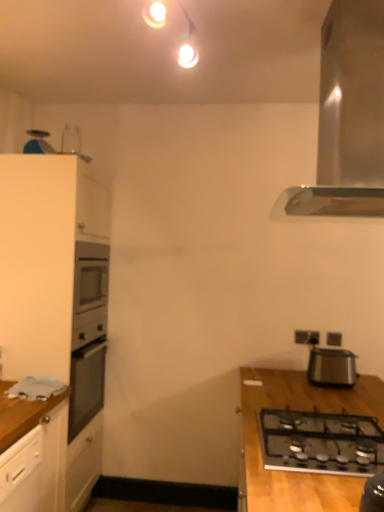
The height and width of the screenshot is (512, 384). Identify the location of wooden table at lower right. (302, 410).

How much space does black plastic electric outlet at upper right, which is counted as the 2th electric outlet, starting from the left, occupy horizontally?

0.76 inches.

Image resolution: width=384 pixels, height=512 pixels. What do you see at coordinates (334, 339) in the screenshot?
I see `black plastic electric outlet at upper right, arranged as the 1th electric outlet when viewed from the right` at bounding box center [334, 339].

Image resolution: width=384 pixels, height=512 pixels. Identify the location of white matte cabinet at left. point(52,328).

This screenshot has height=512, width=384. In order to click on wooden table at lower right in this screenshot , I will do `click(302, 410)`.

Are black plastic electric outlet at upper right, arranged as the 1th electric outlet when viewed from the right, and white matte cabinet at left far apart?

Yes, black plastic electric outlet at upper right, arranged as the 1th electric outlet when viewed from the right, is far from white matte cabinet at left.

Who is shorter, black plastic electric outlet at upper right, which is counted as the 2th electric outlet, starting from the left, or white matte cabinet at left?

Standing shorter between the two is black plastic electric outlet at upper right, which is counted as the 2th electric outlet, starting from the left.

In terms of size, does black plastic electric outlet at upper right, which is counted as the 2th electric outlet, starting from the left, appear bigger or smaller than white matte cabinet at left?

In the image, black plastic electric outlet at upper right, which is counted as the 2th electric outlet, starting from the left, appears to be smaller than white matte cabinet at left.

Does black plastic electric outlet at upper right, which is counted as the 2th electric outlet, starting from the left, have a lesser width compared to white matte cabinet at left?

Yes, black plastic electric outlet at upper right, which is counted as the 2th electric outlet, starting from the left, is thinner than white matte cabinet at left.

From their relative heights in the image, would you say black plastic electric outlet at upper right, arranged as the 1th electric outlet when viewed from the right, is taller or shorter than wooden table at lower right?

black plastic electric outlet at upper right, arranged as the 1th electric outlet when viewed from the right, is shorter than wooden table at lower right.

Would you consider black plastic electric outlet at upper right, which is counted as the 2th electric outlet, starting from the left, to be distant from wooden table at lower right?

No, black plastic electric outlet at upper right, which is counted as the 2th electric outlet, starting from the left, is not far from wooden table at lower right.

From a real-world perspective, who is located higher, black plastic electric outlet at upper right, which is counted as the 2th electric outlet, starting from the left, or wooden table at lower right?

From a 3D spatial view, black plastic electric outlet at upper right, which is counted as the 2th electric outlet, starting from the left, is above.

Considering the relative sizes of black glass gas stove at lower right and white matte cabinet at left in the image provided, is black glass gas stove at lower right taller than white matte cabinet at left?

Incorrect, the height of black glass gas stove at lower right is not larger of that of white matte cabinet at left.

Is black glass gas stove at lower right facing towards white matte cabinet at left?

No, black glass gas stove at lower right is not oriented towards white matte cabinet at left.

Is black glass gas stove at lower right in front of white matte cabinet at left?

Yes, black glass gas stove at lower right is closer to the camera.

From a real-world perspective, is black glass gas stove at lower right positioned above or below white matte cabinet at left?

From a real-world perspective, black glass gas stove at lower right is physically below white matte cabinet at left.

From the image's perspective, which object appears higher, black glass gas stove at lower right or black plastic toaster at right?

black plastic toaster at right is shown above in the image.

Which is closer, (302, 470) or (340, 371)?

Point (302, 470) appears to be closer to the viewer than point (340, 371).

Considering the relative sizes of black glass gas stove at lower right and black plastic toaster at right in the image provided, is black glass gas stove at lower right thinner than black plastic toaster at right?

No.

Who is taller, black glass gas stove at lower right or black plastic toaster at right?

black plastic toaster at right is taller.

Which is farther from the camera, [330,341] or [302,333]?

The point [302,333] is farther from the camera.

Can white plastic electric outlet at upper right, placed as the 1th electric outlet when sorted from left to right, be found inside black plastic electric outlet at upper right, arranged as the 1th electric outlet when viewed from the right?

No.

Can you confirm if black plastic electric outlet at upper right, which is counted as the 2th electric outlet, starting from the left, is taller than white plastic electric outlet at upper right, marked as the 2th electric outlet in a right-to-left arrangement?

No.

From the image's perspective, which is below, black plastic electric outlet at upper right, which is counted as the 2th electric outlet, starting from the left, or white plastic electric outlet at upper right, placed as the 1th electric outlet when sorted from left to right?

black plastic electric outlet at upper right, which is counted as the 2th electric outlet, starting from the left, is shown below in the image.

Considering the points (322, 378) and (331, 337), which point is in front, point (322, 378) or point (331, 337)?

Positioned in front is point (322, 378).

The width and height of the screenshot is (384, 512). What are the coordinates of `appliance below the black plastic electric outlet at upper right, arranged as the 1th electric outlet when viewed from the right (from a real-world perspective)` in the screenshot? It's located at (331, 367).

Looking at this image, considering the sizes of objects black plastic toaster at right and black plastic electric outlet at upper right, which is counted as the 2th electric outlet, starting from the left, in the image provided, who is bigger, black plastic toaster at right or black plastic electric outlet at upper right, which is counted as the 2th electric outlet, starting from the left,?

Bigger between the two is black plastic toaster at right.

Is white matte cabinet at left not near black plastic toaster at right?

Yes, white matte cabinet at left and black plastic toaster at right are located far from each other.

The image size is (384, 512). Find the location of `cabinetry on the left side of black plastic toaster at right`. cabinetry on the left side of black plastic toaster at right is located at coordinates (52, 328).

Is white matte cabinet at left oriented towards black plastic toaster at right?

Yes, white matte cabinet at left is aimed at black plastic toaster at right.

Does white matte cabinet at left have a greater width compared to black plastic toaster at right?

Indeed, white matte cabinet at left has a greater width compared to black plastic toaster at right.

This screenshot has height=512, width=384. In order to click on cabinetry on the left of the black plastic electric outlet at upper right, arranged as the 1th electric outlet when viewed from the right in this screenshot , I will do `click(52, 328)`.

Find the location of a particular element. Image resolution: width=384 pixels, height=512 pixels. table in front of the black plastic electric outlet at upper right, arranged as the 1th electric outlet when viewed from the right is located at coordinates (302, 410).

Based on their spatial positions, is wooden table at lower right or black glass gas stove at lower right closer to satin silver range hood at upper right?

black glass gas stove at lower right is closer to satin silver range hood at upper right.

Estimate the real-world distances between objects in this image. Which object is further from white matte cabinet at left, satin silver range hood at upper right or black glass gas stove at lower right?

satin silver range hood at upper right.

Estimate the real-world distances between objects in this image. Which object is further from white plastic electric outlet at upper right, marked as the 2th electric outlet in a right-to-left arrangement, black glass gas stove at lower right or wooden table at lower right?

Based on the image, black glass gas stove at lower right appears to be further to white plastic electric outlet at upper right, marked as the 2th electric outlet in a right-to-left arrangement.

Estimate the real-world distances between objects in this image. Which object is closer to satin silver range hood at upper right, black plastic toaster at right or white matte cabinet at left?

black plastic toaster at right is positioned closer to the anchor satin silver range hood at upper right.

Based on their spatial positions, is white plastic electric outlet at upper right, marked as the 2th electric outlet in a right-to-left arrangement, or satin silver range hood at upper right further from black plastic toaster at right?

satin silver range hood at upper right lies further to black plastic toaster at right than the other object.

Which object lies further to the anchor point white plastic electric outlet at upper right, marked as the 2th electric outlet in a right-to-left arrangement, black glass gas stove at lower right or black plastic electric outlet at upper right, arranged as the 1th electric outlet when viewed from the right?

The object further to white plastic electric outlet at upper right, marked as the 2th electric outlet in a right-to-left arrangement, is black glass gas stove at lower right.

Estimate the real-world distances between objects in this image. Which object is closer to white matte cabinet at left, black plastic toaster at right or wooden table at lower right?

Among the two, wooden table at lower right is located nearer to white matte cabinet at left.

Which object lies nearer to the anchor point black glass gas stove at lower right, wooden table at lower right or satin silver range hood at upper right?

wooden table at lower right.

The height and width of the screenshot is (512, 384). Find the location of `home appliance positioned between wooden table at lower right and white plastic electric outlet at upper right, marked as the 2th electric outlet in a right-to-left arrangement, from near to far`. home appliance positioned between wooden table at lower right and white plastic electric outlet at upper right, marked as the 2th electric outlet in a right-to-left arrangement, from near to far is located at coordinates (347, 118).

Image resolution: width=384 pixels, height=512 pixels. Identify the location of home appliance between wooden table at lower right and black plastic electric outlet at upper right, arranged as the 1th electric outlet when viewed from the right, along the z-axis. (347, 118).

At what (x,y) coordinates should I click in order to perform the action: click on appliance that lies between satin silver range hood at upper right and wooden table at lower right from top to bottom. Please return your answer as a coordinate pair (x, y). Image resolution: width=384 pixels, height=512 pixels. Looking at the image, I should click on (331, 367).

Where is `appliance between black glass gas stove at lower right and white plastic electric outlet at upper right, placed as the 1th electric outlet when sorted from left to right, from front to back`? The height and width of the screenshot is (512, 384). appliance between black glass gas stove at lower right and white plastic electric outlet at upper right, placed as the 1th electric outlet when sorted from left to right, from front to back is located at coordinates pos(331,367).